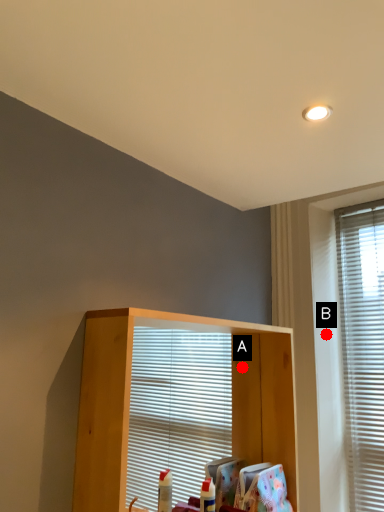
Question: Two points are circled on the image, labeled by A and B beside each circle. Which point is farther from the camera taking this photo?

Choices:
 (A) A is further
 (B) B is further

Answer: (B)